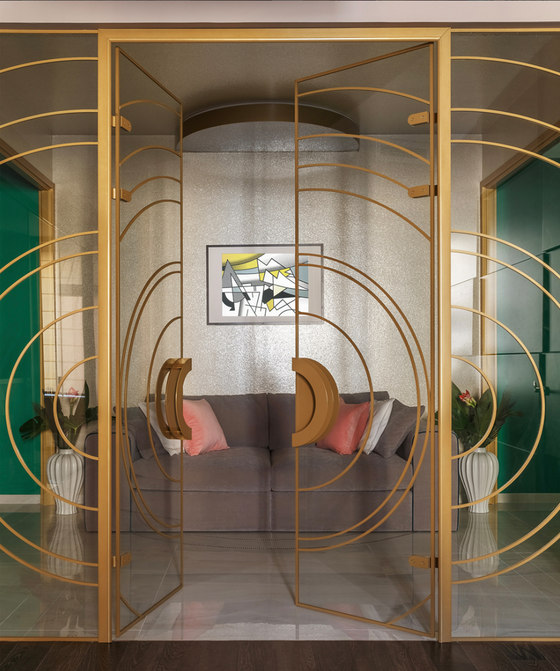
Locate an element on the screen. The height and width of the screenshot is (671, 560). marbled tile floor is located at coordinates (250, 595).